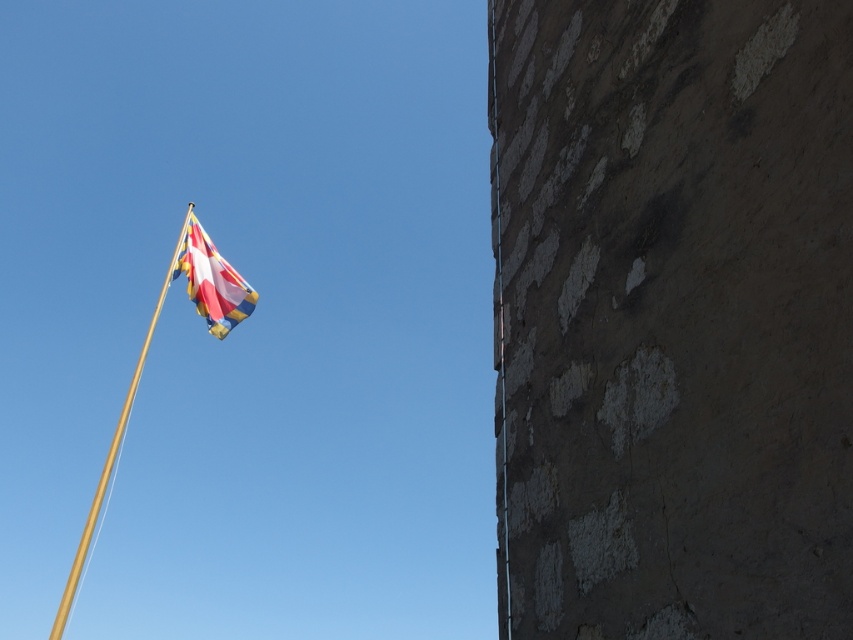
Is point (849, 22) less distant than point (192, 241)?

Yes, it is in front of point (192, 241).

Locate an element on the screen. The width and height of the screenshot is (853, 640). stone textured wall at right is located at coordinates (672, 317).

Does stone textured wall at right appear on the left side of gold polished pole at upper left?

In fact, stone textured wall at right is to the right of gold polished pole at upper left.

Is point (752, 470) positioned in front of point (62, 625)?

Yes.

This screenshot has width=853, height=640. I want to click on stone textured wall at right, so click(672, 317).

I want to click on multi-colored fabric flag at upper left, so click(212, 282).

Which is below, multi-colored fabric flag at upper left or gold polished pole at upper left?

gold polished pole at upper left

Describe the element at coordinates (212, 282) in the screenshot. The width and height of the screenshot is (853, 640). I see `multi-colored fabric flag at upper left` at that location.

The width and height of the screenshot is (853, 640). What are the coordinates of `multi-colored fabric flag at upper left` in the screenshot? It's located at (212, 282).